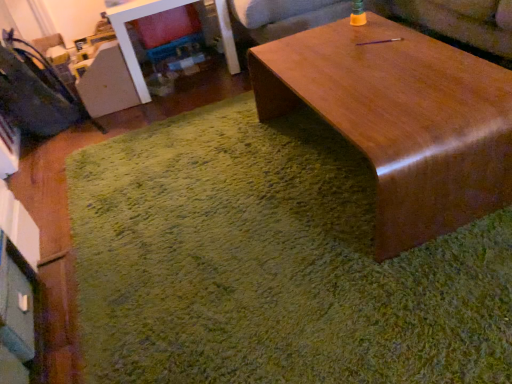
Question: Is wooden couch at upper center surrounding glossy wood coffee table at center?

Choices:
 (A) no
 (B) yes

Answer: (A)

Question: Is wooden couch at upper center at the right side of glossy wood coffee table at center?

Choices:
 (A) no
 (B) yes

Answer: (A)

Question: Considering the relative sizes of wooden couch at upper center and glossy wood coffee table at center in the image provided, is wooden couch at upper center wider than glossy wood coffee table at center?

Choices:
 (A) no
 (B) yes

Answer: (B)

Question: Are wooden couch at upper center and glossy wood coffee table at center far apart?

Choices:
 (A) yes
 (B) no

Answer: (B)

Question: Is wooden couch at upper center positioned with its back to glossy wood coffee table at center?

Choices:
 (A) yes
 (B) no

Answer: (B)

Question: From the image's perspective, is wooden couch at upper center below glossy wood coffee table at center?

Choices:
 (A) no
 (B) yes

Answer: (A)

Question: Does green shaggy rug at center lie behind wooden couch at upper center?

Choices:
 (A) no
 (B) yes

Answer: (A)

Question: Is green shaggy rug at center looking in the opposite direction of wooden couch at upper center?

Choices:
 (A) yes
 (B) no

Answer: (B)

Question: Is green shaggy rug at center oriented towards wooden couch at upper center?

Choices:
 (A) no
 (B) yes

Answer: (A)

Question: Would you say wooden couch at upper center is part of green shaggy rug at center's contents?

Choices:
 (A) no
 (B) yes

Answer: (A)

Question: Considering the relative sizes of green shaggy rug at center and wooden couch at upper center in the image provided, is green shaggy rug at center bigger than wooden couch at upper center?

Choices:
 (A) no
 (B) yes

Answer: (A)

Question: Considering the relative positions of green shaggy rug at center and wooden couch at upper center in the image provided, is green shaggy rug at center in front of wooden couch at upper center?

Choices:
 (A) yes
 (B) no

Answer: (A)

Question: From the image's perspective, is glossy wood coffee table at center below velvet dark blue swivel chair at left?

Choices:
 (A) yes
 (B) no

Answer: (A)